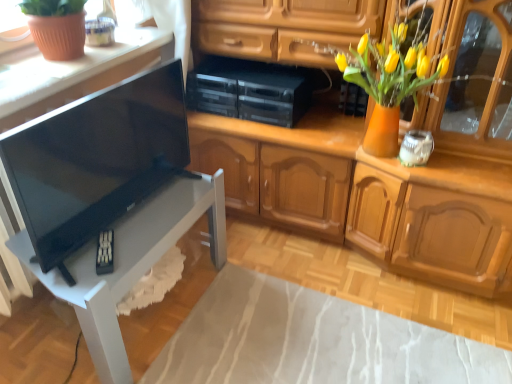
Question: From a real-world perspective, is black plastic stereo at center, the third appliance positioned from the right, above or below white glass jar at upper right, the first appliance positioned from the right?

Choices:
 (A) below
 (B) above

Answer: (B)

Question: Is point (287, 74) closer or farther from the camera than point (403, 163)?

Choices:
 (A) farther
 (B) closer

Answer: (A)

Question: Which is nearer to the black plastic stereo at center, the first appliance from the left?

Choices:
 (A) matte white countertop at upper left
 (B) matte black speaker at upper center, which is the 2th appliance from left to right
 (C) white glass jar at upper right, positioned as the 3th appliance in left-to-right order
 (D) black glossy tv at left
 (E) white glossy table at lower left

Answer: (B)

Question: Estimate the real-world distances between objects in this image. Which object is farther from the black plastic stereo at center, the third appliance positioned from the right?

Choices:
 (A) matte black speaker at upper center, the 2th appliance viewed from the right
 (B) white glossy table at lower left
 (C) black glossy tv at left
 (D) matte white countertop at upper left
 (E) white glass jar at upper right, the first appliance positioned from the right

Answer: (B)